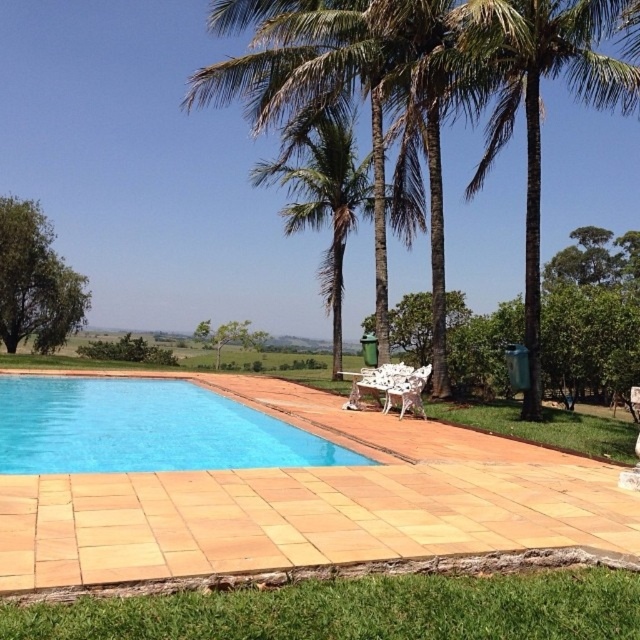
Question: Which object appears closest to the camera in this image?

Choices:
 (A) blue smooth pool at lower left
 (B) green leafy tree at left
 (C) green leafy palm tree at center

Answer: (A)

Question: Can you confirm if green leafy palm tree at upper right is wider than green leafy tree at left?

Choices:
 (A) no
 (B) yes

Answer: (A)

Question: Is green leafy palm tree at upper right to the right of green leafy tree at left from the viewer's perspective?

Choices:
 (A) yes
 (B) no

Answer: (A)

Question: Which point is farther to the camera?

Choices:
 (A) (161, 449)
 (B) (522, 13)

Answer: (B)

Question: Does blue smooth pool at lower left appear over white textured chair at center?

Choices:
 (A) yes
 (B) no

Answer: (B)

Question: Which object is the closest to the green leafy palm tree at center?

Choices:
 (A) blue smooth pool at lower left
 (B) white textured chair at center

Answer: (B)